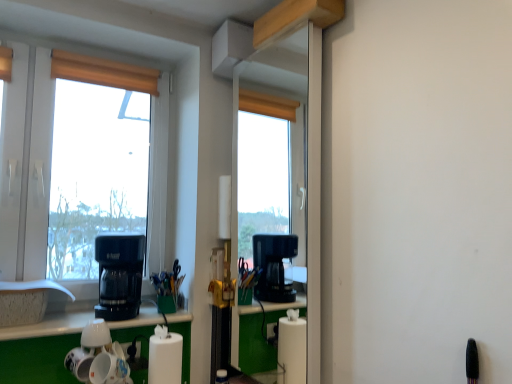
Question: Is white glossy counter top at lower center inside the boundaries of wooden blind at upper left, or outside?

Choices:
 (A) outside
 (B) inside

Answer: (A)

Question: Would you say white glossy counter top at lower center is to the left or to the right of wooden blind at upper left in the picture?

Choices:
 (A) right
 (B) left

Answer: (A)

Question: Based on their relative distances, which object is farther from the black plastic coffee maker at left?

Choices:
 (A) white plastic window at left
 (B) white glossy mugs at lower left
 (C) white glossy counter top at lower center
 (D) wooden blind at upper left

Answer: (D)

Question: Which is farther from the black plastic coffee maker at left?

Choices:
 (A) white glossy counter top at lower center
 (B) white plastic window at left
 (C) white glossy mugs at lower left
 (D) wooden blind at upper left

Answer: (D)